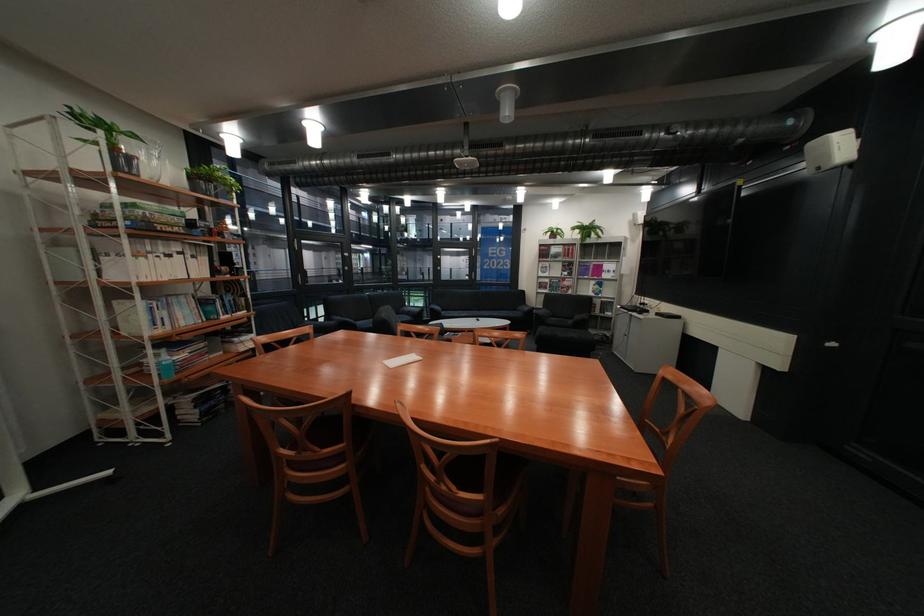
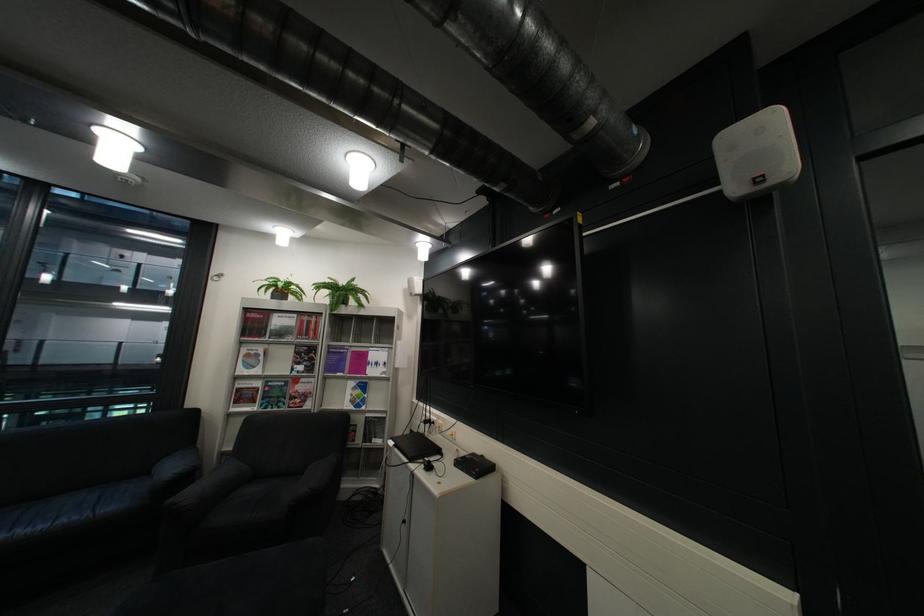
Locate, in the second image, the point that corresponds to pixel 578 265 in the first image.

(311, 353)